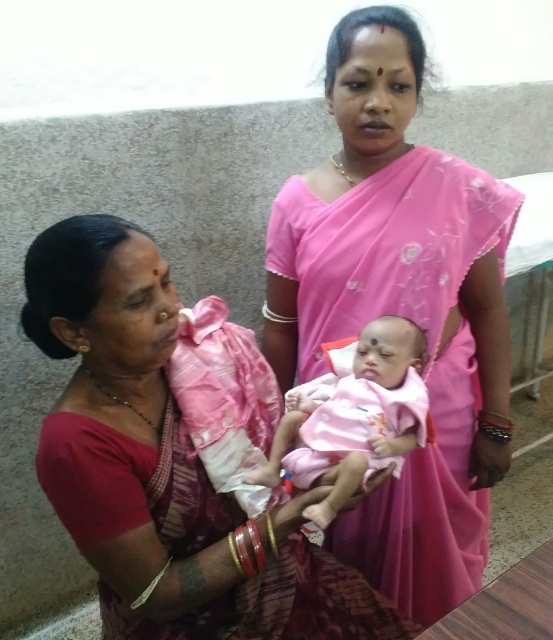
Which is more to the left, matte pink saree at center or pink fabric baby at center?

From the viewer's perspective, matte pink saree at center appears more on the left side.

Can you confirm if matte pink saree at center is thinner than pink fabric baby at center?

Incorrect, matte pink saree at center's width is not less than pink fabric baby at center's.

What do you see at coordinates (164, 467) in the screenshot? This screenshot has width=553, height=640. I see `matte pink saree at center` at bounding box center [164, 467].

What are the coordinates of `matte pink saree at center` in the screenshot? It's located at (164, 467).

Between pink silk saree at center and pink fabric baby at center, which one has more height?

With more height is pink silk saree at center.

Is pink silk saree at center positioned before pink fabric baby at center?

No, pink silk saree at center is behind pink fabric baby at center.

The width and height of the screenshot is (553, 640). I want to click on pink silk saree at center, so click(x=400, y=308).

I want to click on pink silk saree at center, so click(400, 308).

Does pink silk saree at center have a lesser width compared to matte pink saree at center?

Correct, pink silk saree at center's width is less than matte pink saree at center's.

Is pink silk saree at center taller than matte pink saree at center?

Yes, pink silk saree at center is taller than matte pink saree at center.

Is point (405, 24) closer to viewer compared to point (118, 573)?

No, it is behind (118, 573).

Locate an element on the screen. The height and width of the screenshot is (640, 553). pink silk saree at center is located at coordinates (400, 308).